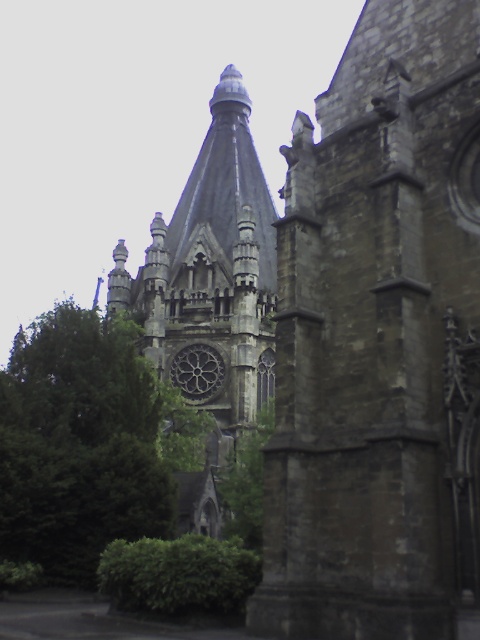
You are standing in front of the cathedral and want to take a photo of both the dark stone tower at center and the green leafy tree at left. Which object should you frame first in your camera to ensure both are fully visible in the shot?

You should frame the dark stone tower at center first because it is taller than the green leafy tree at left, so it requires more vertical space in the photo to capture its full height.

You are an architect analyzing the cathedral layout. You notice the dark stone tower at center and the green leafy tree at left. Which of these two objects takes up more space in the image?

The green leafy tree at left occupies more space than the dark stone tower at center according to the description.